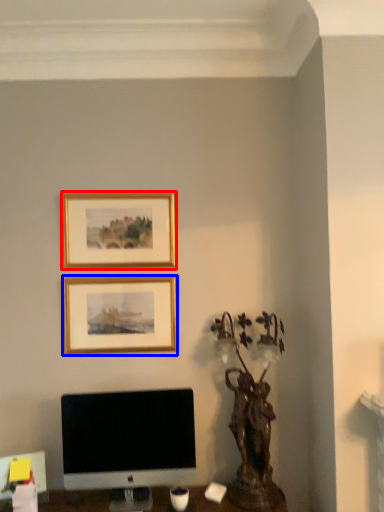
Question: Which point is closer to the camera, picture frame (highlighted by a red box) or picture frame (highlighted by a blue box)?

Choices:
 (A) picture frame
 (B) picture frame

Answer: (B)